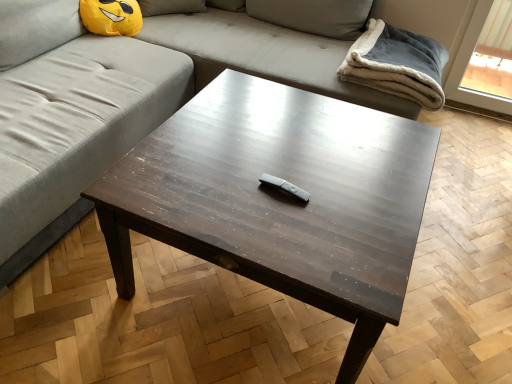
Question: From a real-world perspective, is gray matte wii remote at center positioned above or below gray fabric couch at upper center?

Choices:
 (A) below
 (B) above

Answer: (B)

Question: Is point (296, 195) closer or farther from the camera than point (181, 48)?

Choices:
 (A) farther
 (B) closer

Answer: (B)

Question: Which object is the closest to the gray fabric couch at upper center?

Choices:
 (A) dark wood remote control at center
 (B) gray matte wii remote at center
 (C) gray fleece blanket at upper right

Answer: (C)

Question: Which is farther from the gray fleece blanket at upper right?

Choices:
 (A) gray matte wii remote at center
 (B) dark wood remote control at center
 (C) gray fabric couch at upper center

Answer: (A)